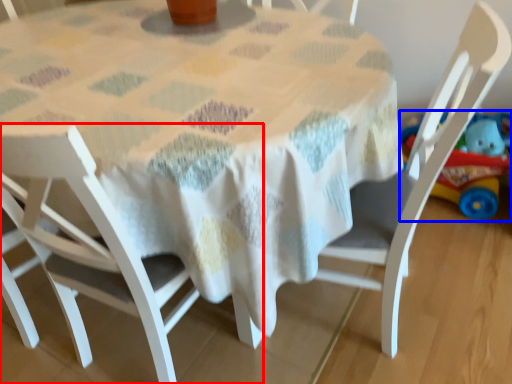
Question: Which of the following is the farthest to the observer, chair (highlighted by a red box) or toy (highlighted by a blue box)?

Choices:
 (A) chair
 (B) toy

Answer: (B)